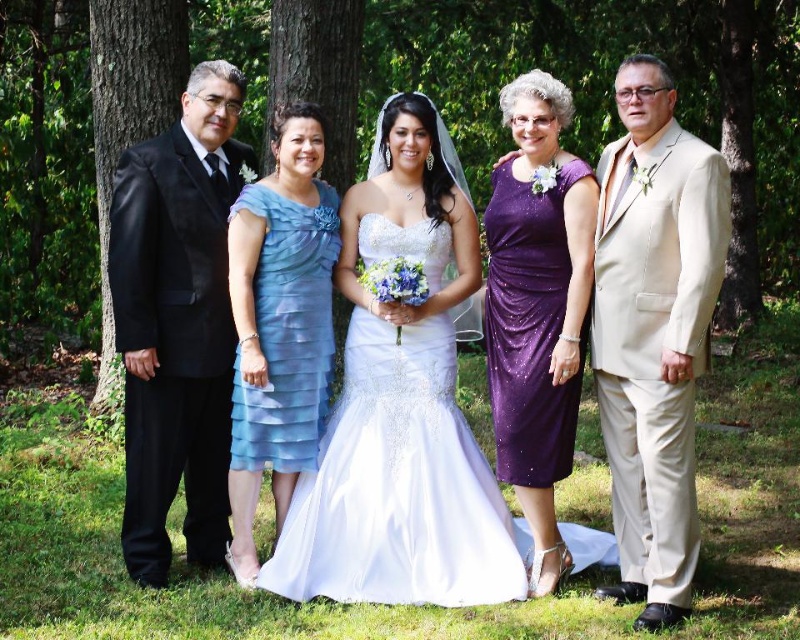
Question: Which object is farther from the camera taking this photo?

Choices:
 (A) white satin dress at center
 (B) light blue chiffon dress at center

Answer: (B)

Question: Can you confirm if white satin dress at center is thinner than brown bark tree at left?

Choices:
 (A) no
 (B) yes

Answer: (A)

Question: Does beige satin suit at right appear on the left side of sparkly purple dress at center?

Choices:
 (A) yes
 (B) no

Answer: (B)

Question: Estimate the real-world distances between objects in this image. Which object is closer to the shiny black suit at left?

Choices:
 (A) brown bark tree at left
 (B) beige satin suit at right
 (C) sparkly purple dress at center
 (D) white satin dress at center

Answer: (D)

Question: Which object is positioned farthest from the light blue chiffon dress at center?

Choices:
 (A) shiny black suit at left
 (B) brown bark tree at left

Answer: (B)

Question: Is shiny black suit at left positioned before sparkly purple dress at center?

Choices:
 (A) no
 (B) yes

Answer: (B)